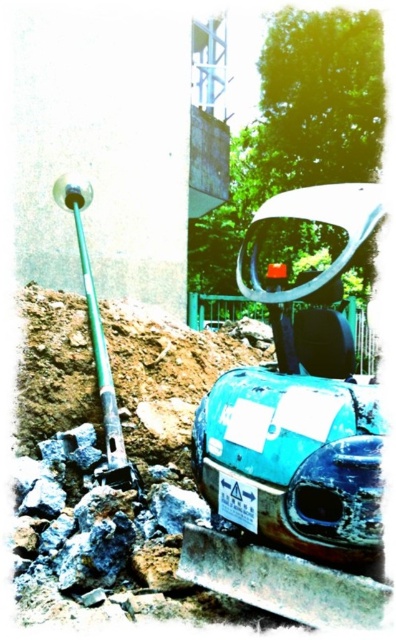
Which is below, brown soil at lower left or green metallic shovel at upper left?

brown soil at lower left

Where is `brown soil at lower left`? Image resolution: width=396 pixels, height=640 pixels. brown soil at lower left is located at coordinates (163, 372).

Can you confirm if teal matte car at center is taller than brown soil at lower left?

No.

Describe the element at coordinates (300, 390) in the screenshot. I see `teal matte car at center` at that location.

I want to click on teal matte car at center, so (300, 390).

Can you confirm if teal matte car at center is smaller than green metallic shovel at upper left?

Indeed, teal matte car at center has a smaller size compared to green metallic shovel at upper left.

Between teal matte car at center and green metallic shovel at upper left, which one is positioned lower?

teal matte car at center is below.

Identify the location of teal matte car at center. This screenshot has height=640, width=396. (300, 390).

Locate an element on the screen. This screenshot has width=396, height=640. teal matte car at center is located at coordinates (300, 390).